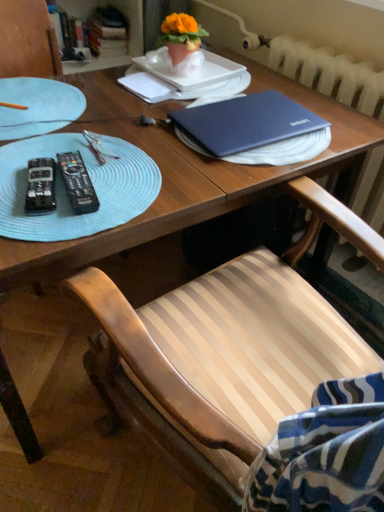
Identify the location of free point above blue woven placemat at left, which is the first glass plate from bottom to top (from a real-world perspective). The width and height of the screenshot is (384, 512). (77, 169).